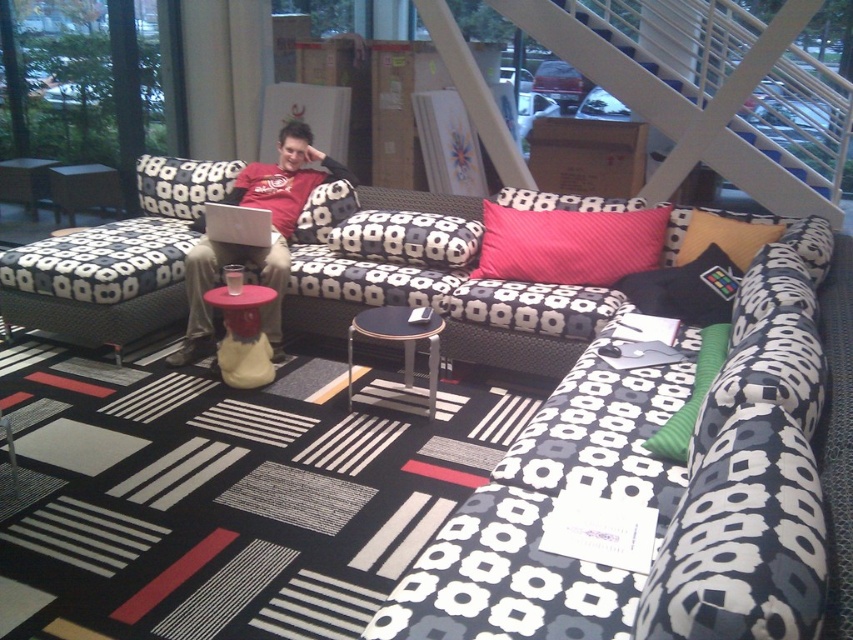
Question: Which object appears closest to the camera in this image?

Choices:
 (A) red matte shirt at center
 (B) pink textured pillow at center
 (C) matte plastic stool at center
 (D) pink fabric pillow at center

Answer: (C)

Question: Which of the following is the closest to the observer?

Choices:
 (A) (700, 236)
 (B) (674, 298)
 (C) (328, 189)

Answer: (B)

Question: Is matte plastic cup at center bigger than matte black couch at left?

Choices:
 (A) yes
 (B) no

Answer: (B)

Question: Is red matte shirt at center smaller than pink textured pillow at center?

Choices:
 (A) yes
 (B) no

Answer: (B)

Question: Which point is closer to the camera taking this photo?

Choices:
 (A) (618, 237)
 (B) (695, 225)
 (C) (402, 314)

Answer: (C)

Question: Can you confirm if matte plastic stool at center is bigger than matte plastic cup at center?

Choices:
 (A) no
 (B) yes

Answer: (A)